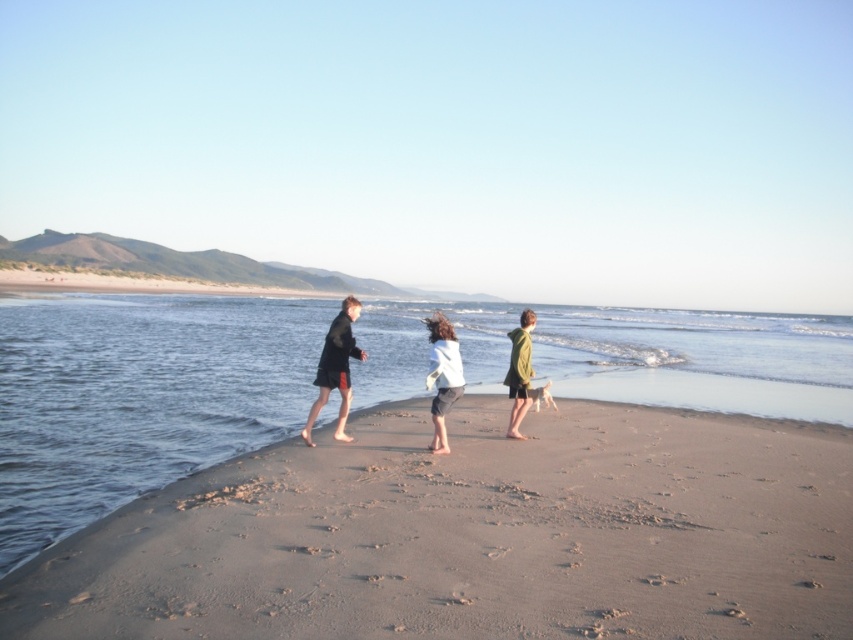
Question: Which object is farther from the camera taking this photo?

Choices:
 (A) green textured hoodie at center
 (B) white soft sweater at center
 (C) light brown sand at lower center

Answer: (A)

Question: Does dark matte coat at center appear on the left side of green textured hoodie at center?

Choices:
 (A) yes
 (B) no

Answer: (A)

Question: Observing the image, what is the correct spatial positioning of light brown sand at lower center in reference to dark matte coat at center?

Choices:
 (A) left
 (B) right

Answer: (B)

Question: Which point appears closest to the camera in this image?

Choices:
 (A) (496, 605)
 (B) (431, 330)

Answer: (A)

Question: Can you confirm if light brown sand at lower center is positioned to the left of dark matte coat at center?

Choices:
 (A) yes
 (B) no

Answer: (B)

Question: Which object is closer to the camera taking this photo?

Choices:
 (A) light brown sand at lower center
 (B) green textured hoodie at center
 (C) dark matte coat at center
 (D) white soft sweater at center

Answer: (A)